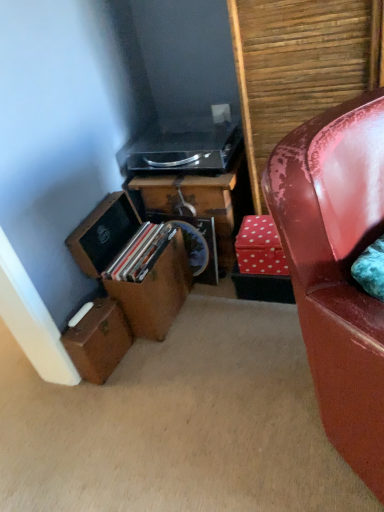
Question: Considering the relative sizes of wooden box at lower left, the first box in the top-to-bottom sequence, and shiny red leather chair at right in the image provided, is wooden box at lower left, the first box in the top-to-bottom sequence, shorter than shiny red leather chair at right?

Choices:
 (A) yes
 (B) no

Answer: (A)

Question: Would you say wooden box at lower left, the second box positioned from the bottom, is outside shiny red leather chair at right?

Choices:
 (A) yes
 (B) no

Answer: (A)

Question: Can you confirm if wooden box at lower left, the first box in the top-to-bottom sequence, is positioned to the right of shiny red leather chair at right?

Choices:
 (A) no
 (B) yes

Answer: (A)

Question: From the image's perspective, is wooden box at lower left, the second box positioned from the bottom, above shiny red leather chair at right?

Choices:
 (A) no
 (B) yes

Answer: (B)

Question: Does wooden box at lower left, the second box positioned from the bottom, have a greater height compared to shiny red leather chair at right?

Choices:
 (A) yes
 (B) no

Answer: (B)

Question: Is wooden box at lower left, the first box in the top-to-bottom sequence, not close to shiny red leather chair at right?

Choices:
 (A) yes
 (B) no

Answer: (B)

Question: Is wooden desk at center wider than wooden box at lower left, the first box in the top-to-bottom sequence?

Choices:
 (A) yes
 (B) no

Answer: (B)

Question: From a real-world perspective, is wooden desk at center over wooden box at lower left, the first box in the top-to-bottom sequence?

Choices:
 (A) no
 (B) yes

Answer: (A)

Question: Considering the relative sizes of wooden desk at center and wooden box at lower left, the first box in the top-to-bottom sequence, in the image provided, is wooden desk at center thinner than wooden box at lower left, the first box in the top-to-bottom sequence,?

Choices:
 (A) no
 (B) yes

Answer: (B)

Question: Does wooden desk at center lie in front of wooden box at lower left, the second box positioned from the bottom?

Choices:
 (A) yes
 (B) no

Answer: (B)

Question: Is wooden box at lower left, the second box positioned from the bottom, a part of wooden desk at center?

Choices:
 (A) yes
 (B) no

Answer: (B)

Question: Is wooden desk at center oriented away from wooden box at lower left, the first box in the top-to-bottom sequence?

Choices:
 (A) yes
 (B) no

Answer: (B)

Question: Does wooden box at lower left, the first box in the top-to-bottom sequence, have a lesser width compared to brown leather suitcase at lower left, acting as the second box starting from the top?

Choices:
 (A) no
 (B) yes

Answer: (A)